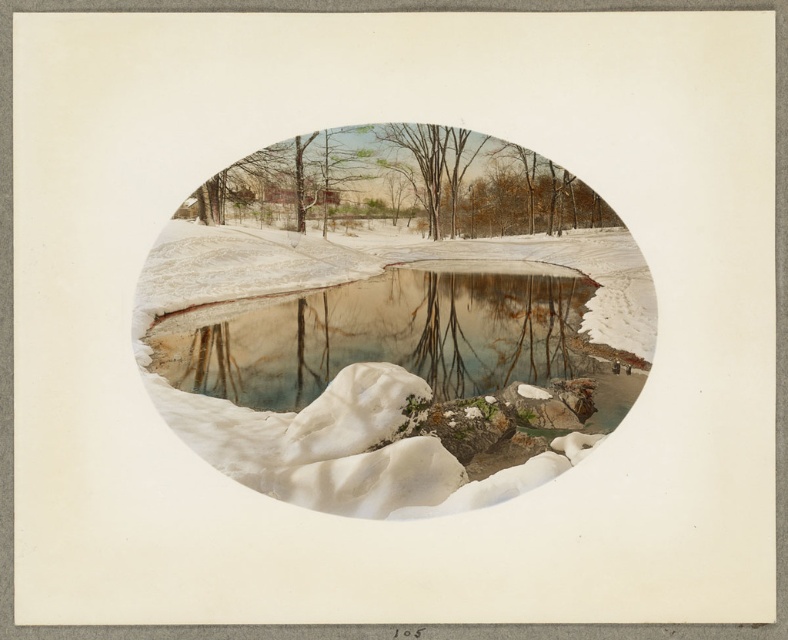
Question: Among these points, which one is farthest from the camera?

Choices:
 (A) (433, 156)
 (B) (522, 195)
 (C) (329, 326)

Answer: (C)

Question: In this image, where is smooth brown tree at center located relative to brown matte tree at center?

Choices:
 (A) above
 (B) below

Answer: (B)

Question: Does translucent ice water at center have a smaller size compared to smooth brown tree at center?

Choices:
 (A) no
 (B) yes

Answer: (A)

Question: Which of the following is the farthest from the observer?

Choices:
 (A) (396, 179)
 (B) (458, 326)
 (C) (426, 179)
 (D) (281, 161)

Answer: (B)

Question: Among these points, which one is nearest to the camera?

Choices:
 (A) (318, 458)
 (B) (359, 202)
 (C) (443, 148)
 (D) (430, 273)

Answer: (A)

Question: Is translucent ice water at center bigger than smooth brown tree at center?

Choices:
 (A) yes
 (B) no

Answer: (A)